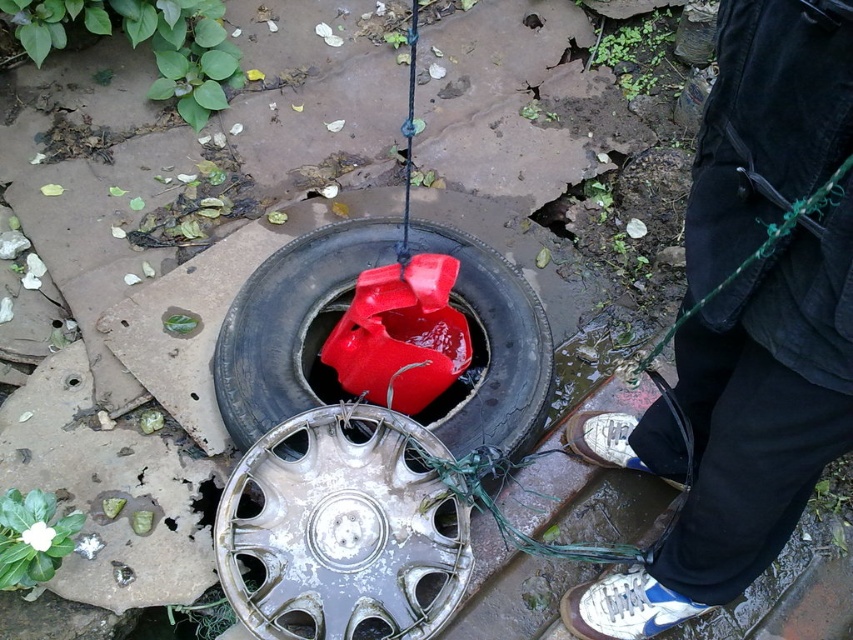
You are standing near the glossy rubber tire at center and want to place an object on the dark blue jeans at lower right. Can you place it directly on top of the tire without touching the jeans?

The dark blue jeans at lower right is positioned over the glossy rubber tire at center, so placing an object on the jeans would also place it on the tire. However, since the jeans are already over the tire, you cannot place the object directly on the tire without it also touching the jeans.

You are a mechanic trying to access the silver metallic hubcap at center to inspect it. Since it is located under the glossy rubber tire at center, can you easily reach it without moving the tire?

The silver metallic hubcap at center is positioned under the glossy rubber tire at center, so you cannot easily reach it without moving the tire first.

You are a delivery person who needs to place a package on the ground near the glossy rubber tire at center. However, there are dark blue jeans at lower right nearby. Can you fit the package between them without moving either object?

The dark blue jeans at lower right is larger in size than the glossy rubber tire at center, so there might not be enough space between them to place the package without moving at least one of the objects.